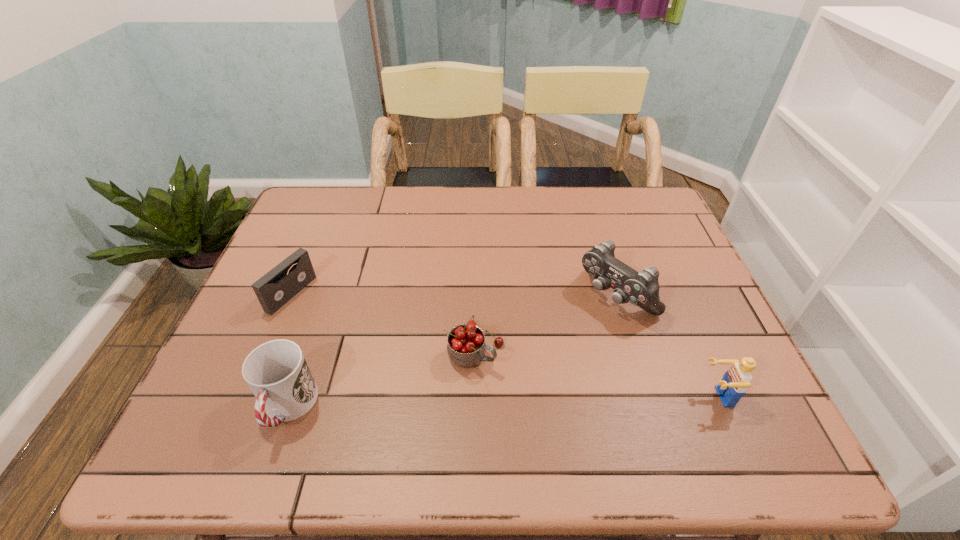
Locate an element on the screen. The image size is (960, 540). cup is located at coordinates (277, 373).

Image resolution: width=960 pixels, height=540 pixels. In order to click on Lego in this screenshot , I will do `click(737, 379)`.

Where is `control`? The width and height of the screenshot is (960, 540). control is located at coordinates (641, 289).

Where is `the third object from right to left`? the third object from right to left is located at coordinates (466, 347).

Image resolution: width=960 pixels, height=540 pixels. What are the coordinates of `the shortest object` in the screenshot? It's located at (273, 290).

Where is `vacant space situated on the face of the rightmost object`? Image resolution: width=960 pixels, height=540 pixels. vacant space situated on the face of the rightmost object is located at coordinates (584, 396).

Where is `free spot located on the face of the rightmost object`? free spot located on the face of the rightmost object is located at coordinates (535, 396).

Identify the location of free space located 0.190m on the face of the rightmost object. (608, 396).

Find the location of a particular element. The height and width of the screenshot is (540, 960). vacant space located on the surface of the fourth object from left to right with buttons is located at coordinates (535, 360).

The height and width of the screenshot is (540, 960). In order to click on vacant space located on the surface of the fourth object from left to right with buttons in this screenshot , I will do [468, 410].